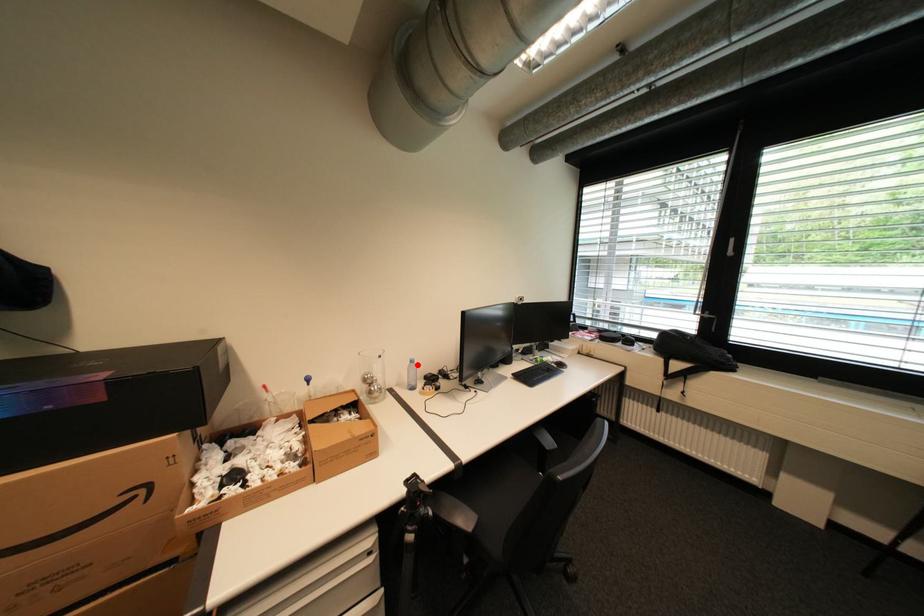
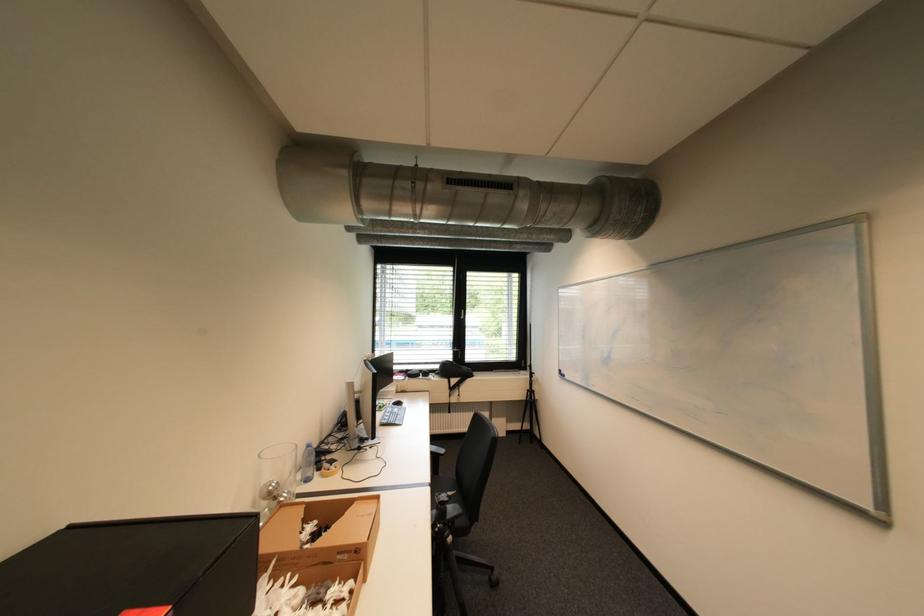
Question: I am providing you with two images of the same scene from different viewpoints. Image1 has a red point marked. In image2, the corresponding 3D location appears at what relative position? Reply with the corresponding letter.

Choices:
 (A) Closer
 (B) Farther

Answer: (A)